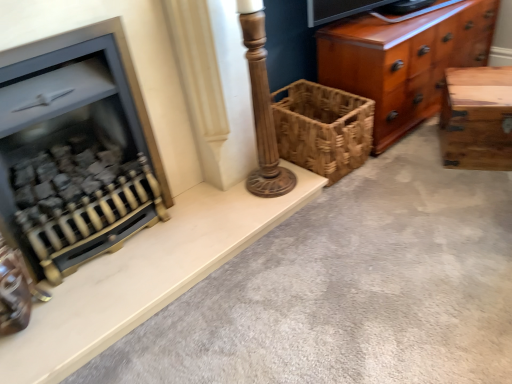
The height and width of the screenshot is (384, 512). I want to click on vacant area that is situated to the right of woven brown basket at center, so click(x=401, y=157).